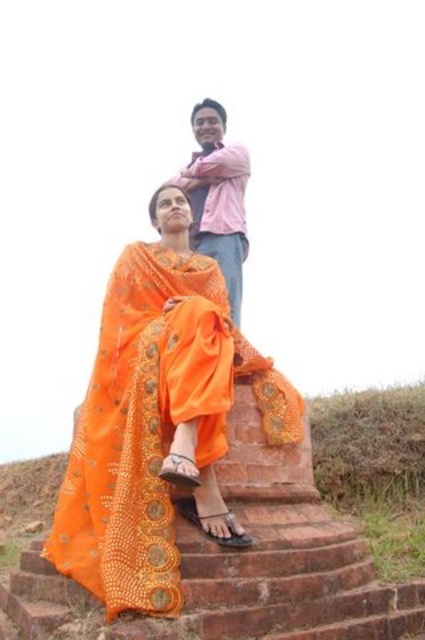
Question: Is orange sheer fabric at center bigger than pink cotton shirt at upper center?

Choices:
 (A) no
 (B) yes

Answer: (B)

Question: Is orange sheer fabric at center closer to the viewer compared to pink cotton shirt at upper center?

Choices:
 (A) no
 (B) yes

Answer: (B)

Question: Which point is closer to the camera?

Choices:
 (A) orange sheer fabric at center
 (B) pink cotton shirt at upper center

Answer: (A)

Question: Can you confirm if orange sheer fabric at center is bigger than pink cotton shirt at upper center?

Choices:
 (A) no
 (B) yes

Answer: (B)

Question: Which object is farther from the camera taking this photo?

Choices:
 (A) pink cotton shirt at upper center
 (B) orange sheer fabric at center

Answer: (A)

Question: Which point is closer to the camera?

Choices:
 (A) orange sheer fabric at center
 (B) pink cotton shirt at upper center

Answer: (A)